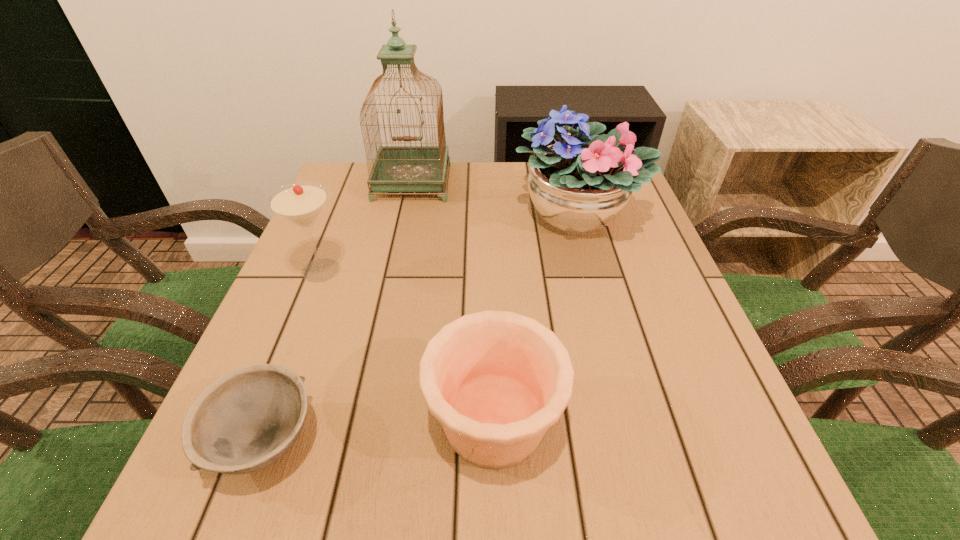
At what (x,y) coordinates should I click in order to perform the action: click on unoccupied area between the third shortest object and the second shortest object. Please return your answer as a coordinate pair (x, y). The height and width of the screenshot is (540, 960). Looking at the image, I should click on (408, 345).

Identify the location of vacant space that is in between the third shortest object and the second shortest object. (408, 345).

The height and width of the screenshot is (540, 960). In order to click on empty location between the bowl and the fourth tallest object in this screenshot , I will do `click(379, 430)`.

Identify the location of vacant area between the bouquet and the shortest object. The width and height of the screenshot is (960, 540). (420, 328).

At what (x,y) coordinates should I click in order to perform the action: click on free spot between the pottery and the birdcage. Please return your answer as a coordinate pair (x, y). This screenshot has width=960, height=540. Looking at the image, I should click on (453, 300).

You are a GUI agent. You are given a task and a screenshot of the screen. Output one action in this format:
    pyautogui.click(x=<x>, y=<y>)
    Task: Click on the free space between the pottery and the martini
    
    Given the screenshot: What is the action you would take?
    pyautogui.click(x=408, y=345)

Where is `free space between the shortest object and the second shortest object`? The image size is (960, 540). free space between the shortest object and the second shortest object is located at coordinates (379, 430).

This screenshot has height=540, width=960. In order to click on object that is the fourth closest to the birdcage in this screenshot , I will do pos(246,420).

Locate which object is the closest to the fourth shortest object. Please provide its 2D coordinates. Your answer should be formatted as a tuple, i.e. [(x, y)], where the tuple contains the x and y coordinates of a point satisfying the conditions above.

[(404, 168)]

Identify the location of vacant space that satisfies the following two spatial constraints: 1. on the back side of the bowl; 2. on the left side of the second shortest object. This screenshot has height=540, width=960. (273, 419).